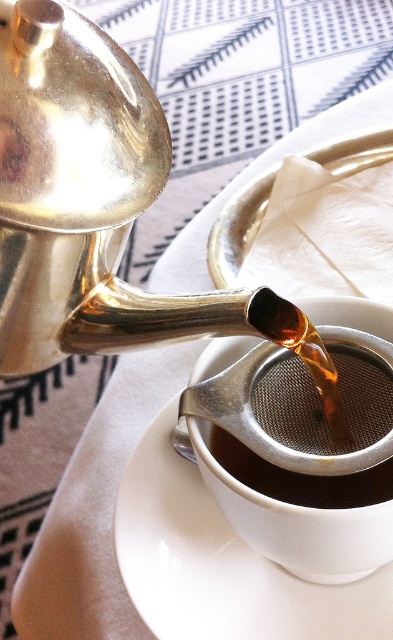
Question: Is white ceramic saucer at center to the right of shiny metallic coffee at center from the viewer's perspective?

Choices:
 (A) no
 (B) yes

Answer: (A)

Question: Which object appears farthest from the camera in this image?

Choices:
 (A) white ceramic saucer at center
 (B) shiny metallic coffee at center

Answer: (B)

Question: Which object is closer to the camera taking this photo?

Choices:
 (A) shiny metallic coffee at center
 (B) white ceramic saucer at center

Answer: (B)

Question: Which point is farther to the camera?

Choices:
 (A) (174, 408)
 (B) (334, 476)

Answer: (A)

Question: Does white ceramic saucer at center have a lesser width compared to shiny metallic coffee at center?

Choices:
 (A) no
 (B) yes

Answer: (A)

Question: In this image, where is white ceramic saucer at center located relative to shiny metallic coffee at center?

Choices:
 (A) left
 (B) right

Answer: (A)